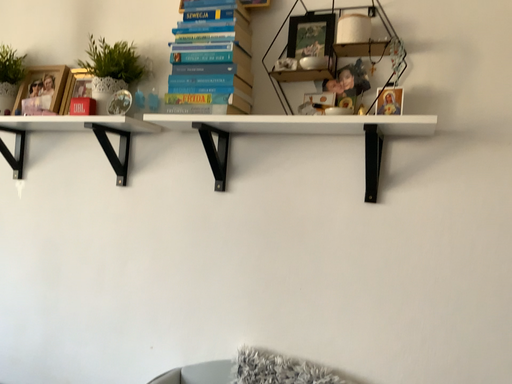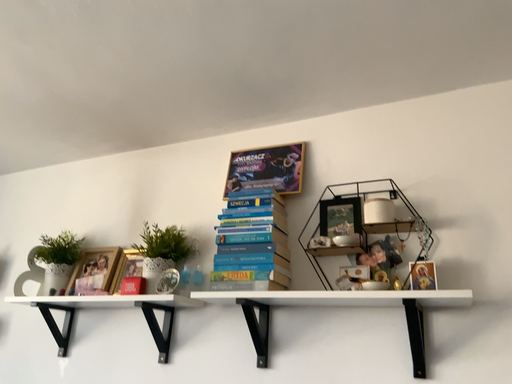
Question: Which way did the camera rotate in the video?

Choices:
 (A) rotated downward
 (B) rotated upward

Answer: (B)